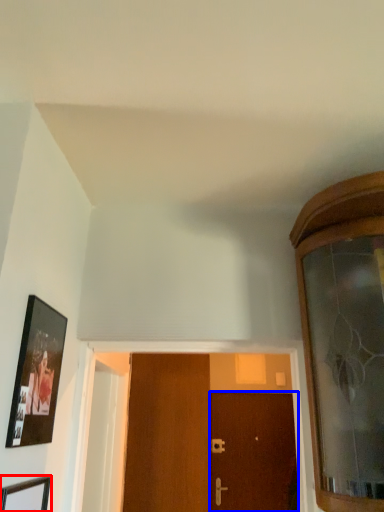
Question: Which point is further to the camera, picture frame (highlighted by a red box) or door (highlighted by a blue box)?

Choices:
 (A) picture frame
 (B) door

Answer: (B)